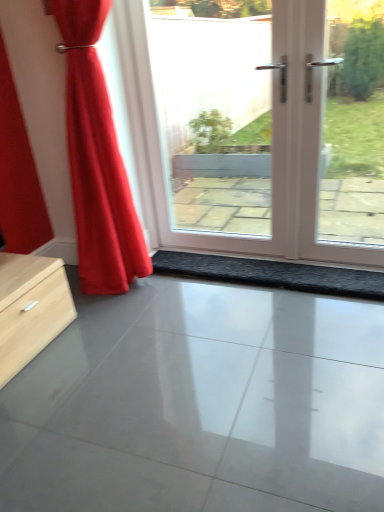
Question: Is glossy concrete floor at center positioned in front of white glossy door at center?

Choices:
 (A) yes
 (B) no

Answer: (A)

Question: Is the position of glossy concrete floor at center more distant than that of white glossy door at center?

Choices:
 (A) yes
 (B) no

Answer: (B)

Question: From a real-world perspective, is glossy concrete floor at center under white glossy door at center?

Choices:
 (A) no
 (B) yes

Answer: (B)

Question: From the image's perspective, would you say glossy concrete floor at center is positioned over white glossy door at center?

Choices:
 (A) no
 (B) yes

Answer: (A)

Question: Is glossy concrete floor at center at the left side of white glossy door at center?

Choices:
 (A) yes
 (B) no

Answer: (A)

Question: Is the surface of glossy concrete floor at center in direct contact with white glossy door at center?

Choices:
 (A) no
 (B) yes

Answer: (A)

Question: From the image's perspective, is glossy concrete floor at center located beneath satin red curtain at left?

Choices:
 (A) no
 (B) yes

Answer: (B)

Question: Is glossy concrete floor at center wider than satin red curtain at left?

Choices:
 (A) no
 (B) yes

Answer: (B)

Question: From the image's perspective, is glossy concrete floor at center on top of satin red curtain at left?

Choices:
 (A) no
 (B) yes

Answer: (A)

Question: Is glossy concrete floor at center oriented away from satin red curtain at left?

Choices:
 (A) no
 (B) yes

Answer: (A)

Question: Is the depth of glossy concrete floor at center greater than that of satin red curtain at left?

Choices:
 (A) no
 (B) yes

Answer: (A)

Question: Can you confirm if glossy concrete floor at center is positioned to the right of satin red curtain at left?

Choices:
 (A) no
 (B) yes

Answer: (B)

Question: Is white glossy door at center far from black textured mat at center?

Choices:
 (A) no
 (B) yes

Answer: (A)